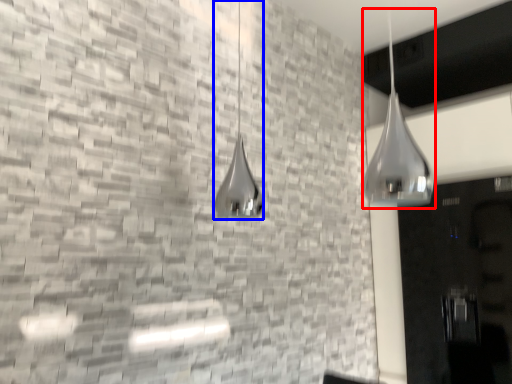
Question: Which object is closer to the camera taking this photo, shower (highlighted by a red box) or shower (highlighted by a blue box)?

Choices:
 (A) shower
 (B) shower

Answer: (A)